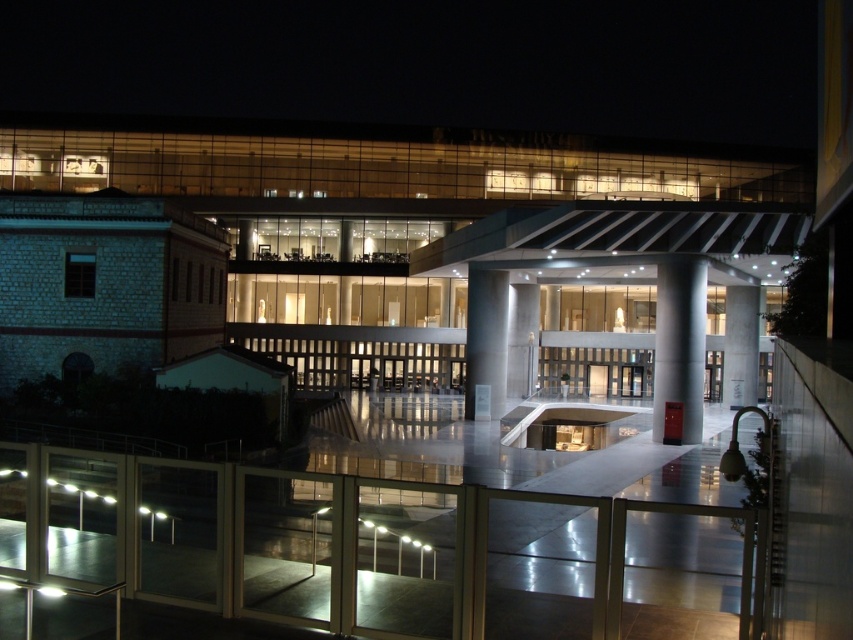
You are an architect examining the building structure. You notice the sleek metallic column at center and the white glossy pillar at center. Which one would appear larger in your field of view?

The sleek metallic column at center is closer to the viewer than the white glossy pillar at center, so it would appear larger in your field of view.